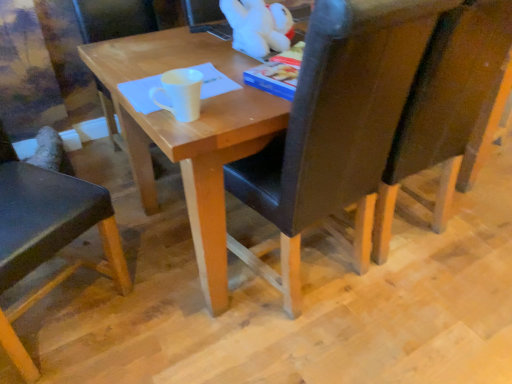
The image size is (512, 384). Identify the location of vacant space underneath matte black chair at left, the 4th chair from the right (from a real-world perspective). (63, 308).